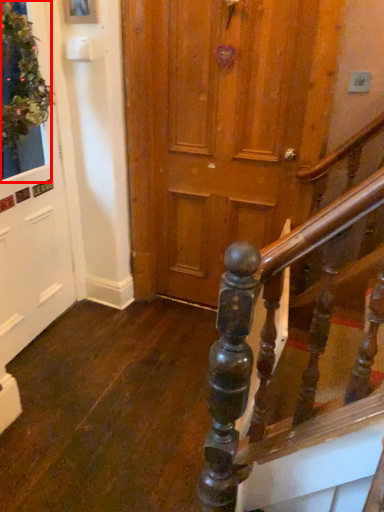
Question: From the image's perspective, where is window (annotated by the red box) located relative to door?

Choices:
 (A) below
 (B) above

Answer: (B)